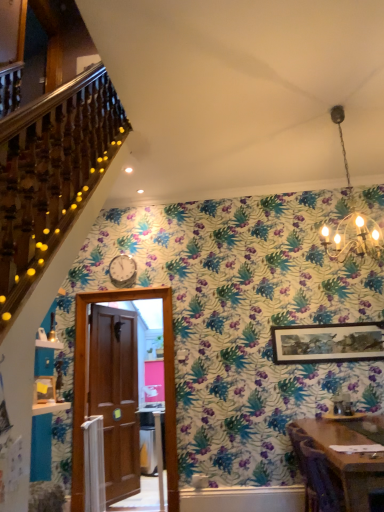
Locate an element on the screen. Image resolution: width=384 pixels, height=512 pixels. vacant point above gold chain chandelier at upper center (from a real-world perspective) is located at coordinates (326, 110).